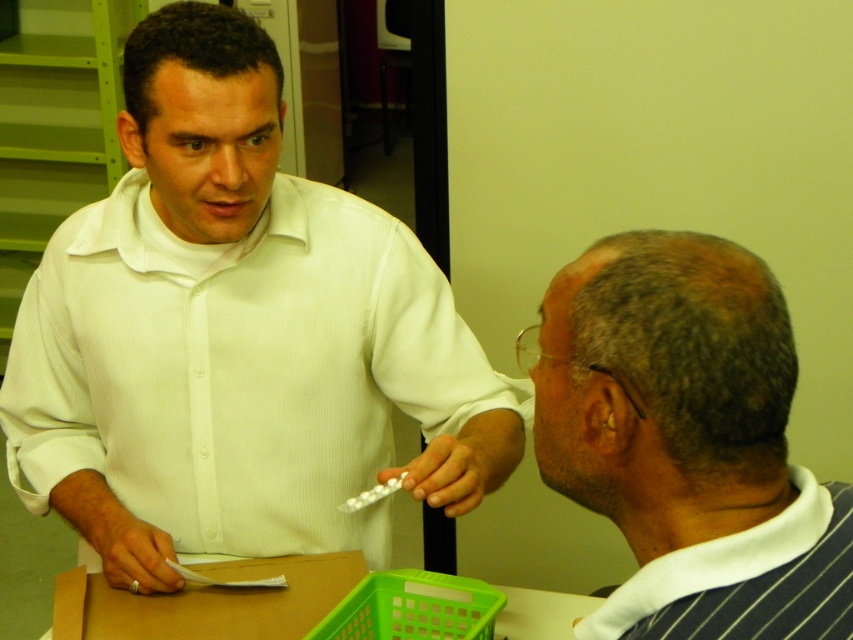
Image resolution: width=853 pixels, height=640 pixels. Find the location of `striped fabric shirt at right`. striped fabric shirt at right is located at coordinates (688, 440).

Who is taller, striped fabric shirt at right or green plastic crate at lower center?

With more height is striped fabric shirt at right.

Measure the distance between striped fabric shirt at right and camera.

striped fabric shirt at right and camera are 26.71 inches apart.

You are a GUI agent. You are given a task and a screenshot of the screen. Output one action in this format:
    pyautogui.click(x=<x>, y=<y>)
    Task: Click on the striped fabric shirt at right
    The height and width of the screenshot is (640, 853).
    Given the screenshot: What is the action you would take?
    coord(688,440)

Measure the distance from white pinstripe shirt at right to green plastic crate at lower center.

19.06 inches

Where is `white pinstripe shirt at right`? The height and width of the screenshot is (640, 853). white pinstripe shirt at right is located at coordinates (746, 579).

Can you confirm if striped fabric shirt at right is positioned to the right of white pinstripe shirt at right?

In fact, striped fabric shirt at right is to the left of white pinstripe shirt at right.

Image resolution: width=853 pixels, height=640 pixels. Identify the location of striped fabric shirt at right. (688, 440).

Which is in front, point (631, 595) or point (795, 531)?

Point (631, 595) is in front.

You are a GUI agent. You are given a task and a screenshot of the screen. Output one action in this format:
    pyautogui.click(x=<x>, y=<y>)
    Task: Click on the striped fabric shirt at right
    Image resolution: width=853 pixels, height=640 pixels.
    Given the screenshot: What is the action you would take?
    pyautogui.click(x=688, y=440)